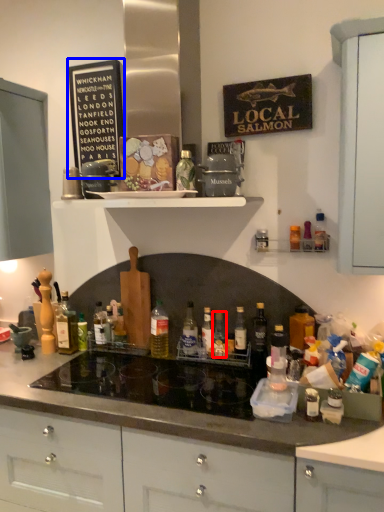
Question: Which object is closer to the camera taking this photo, bottle (highlighted by a red box) or bulletin board (highlighted by a blue box)?

Choices:
 (A) bottle
 (B) bulletin board

Answer: (A)